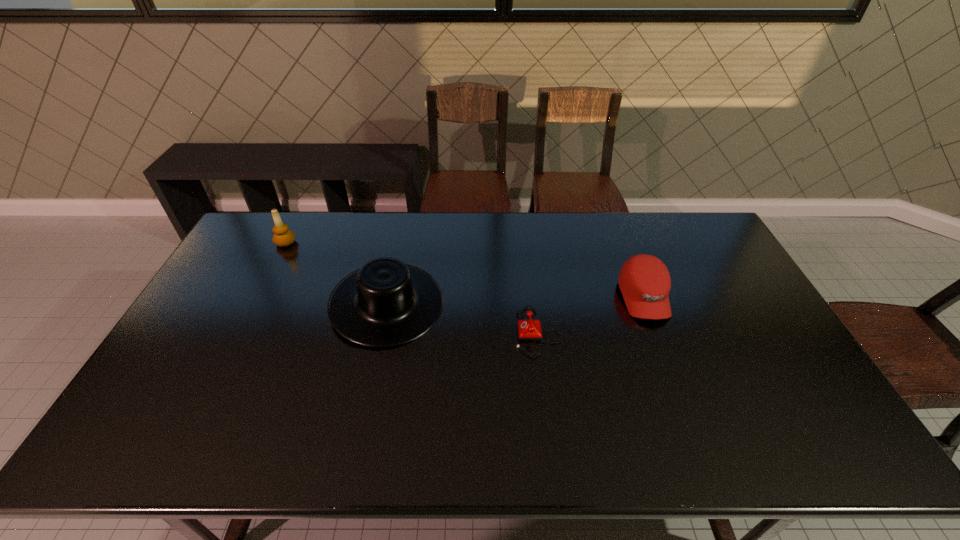
In the image, there is a desktop. At what (x,y) coordinates should I click in order to perform the action: click on vacant space at the far right corner. Please return your answer as a coordinate pair (x, y). Image resolution: width=960 pixels, height=540 pixels. Looking at the image, I should click on (688, 220).

You are a GUI agent. You are given a task and a screenshot of the screen. Output one action in this format:
    pyautogui.click(x=<x>, y=<y>)
    Task: Click on the free spot between the rightmost object and the dress hat
    
    Given the screenshot: What is the action you would take?
    pyautogui.click(x=516, y=300)

The width and height of the screenshot is (960, 540). I want to click on free space between the cap and the dress hat, so click(x=516, y=300).

Image resolution: width=960 pixels, height=540 pixels. What are the coordinates of `free space that is in between the telephone and the third object from right to left` in the screenshot? It's located at (463, 318).

At what (x,y) coordinates should I click in order to perform the action: click on vacant region between the rightmost object and the second object from left to right. Please return your answer as a coordinate pair (x, y). This screenshot has height=540, width=960. Looking at the image, I should click on (516, 300).

Image resolution: width=960 pixels, height=540 pixels. I want to click on free space between the second shortest object and the second object from left to right, so click(x=516, y=300).

Identify the location of free space between the candle_holder and the cap. The height and width of the screenshot is (540, 960). (465, 270).

Where is `unoccupied position between the third object from left to right and the third object from right to left`? unoccupied position between the third object from left to right and the third object from right to left is located at coordinates (463, 318).

Locate which object ranks second in proximity to the candle_holder. Please provide its 2D coordinates. Your answer should be formatted as a tuple, i.e. [(x, y)], where the tuple contains the x and y coordinates of a point satisfying the conditions above.

[(529, 329)]

This screenshot has height=540, width=960. What are the coordinates of `object that stands as the third closest to the dress hat` in the screenshot? It's located at (644, 280).